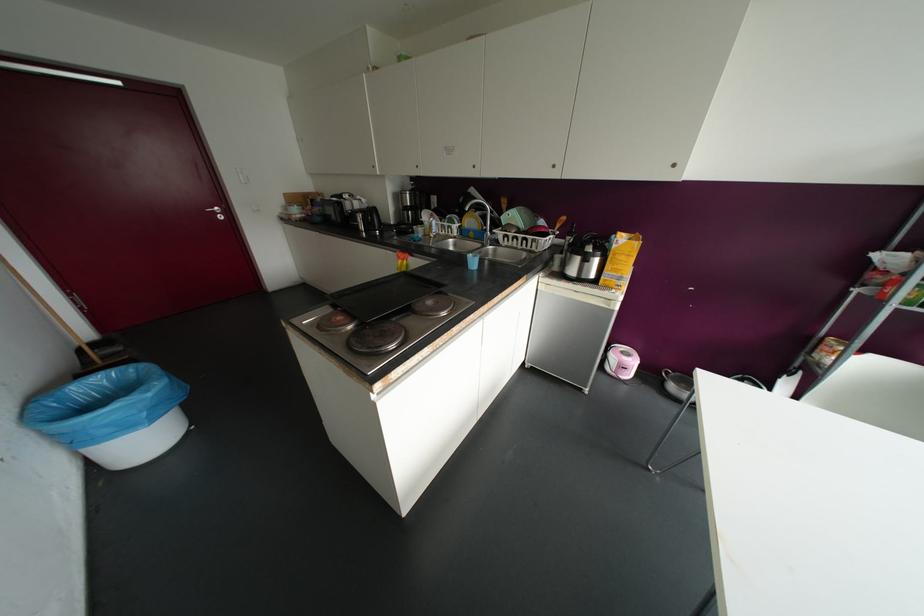
The image size is (924, 616). In order to click on small metal pot in this screenshot , I will do `click(590, 238)`.